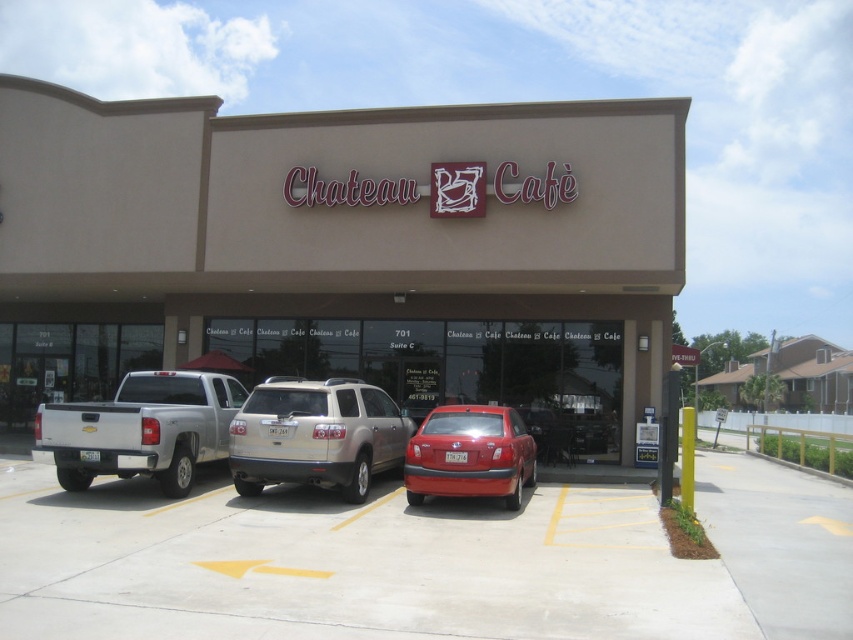
Question: Which point appears closest to the camera in this image?

Choices:
 (A) (524, 444)
 (B) (437, 323)
 (C) (624, 532)

Answer: (C)

Question: Among these points, which one is nearest to the camera?

Choices:
 (A) (347, 387)
 (B) (544, 227)
 (C) (178, 481)

Answer: (C)

Question: Is beige/smooth building at center wider than shiny red sedan at center?

Choices:
 (A) no
 (B) yes

Answer: (B)

Question: Can you confirm if beige/smooth building at center is wider than concrete parking lot at center?

Choices:
 (A) yes
 (B) no

Answer: (A)

Question: Is satin silver suv at center positioned in front of shiny red sedan at center?

Choices:
 (A) no
 (B) yes

Answer: (A)

Question: Which object appears closest to the camera in this image?

Choices:
 (A) beige/smooth building at center
 (B) concrete parking lot at center

Answer: (B)